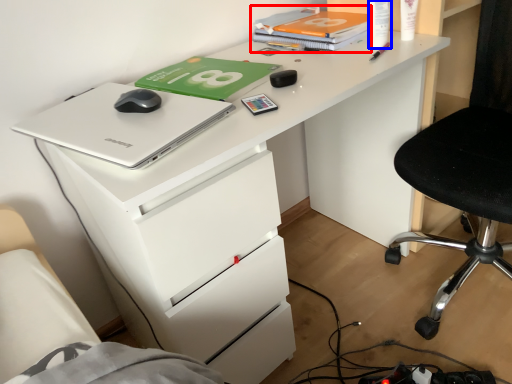
Question: Which of the following is the closest to the observer, book (highlighted by a red box) or stationery (highlighted by a blue box)?

Choices:
 (A) book
 (B) stationery

Answer: (B)